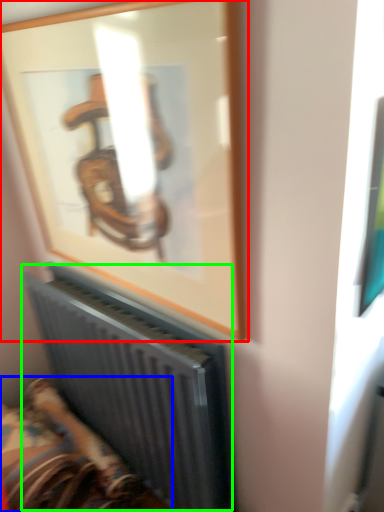
Question: Based on their relative distances, which object is nearer to picture frame (highlighted by a red box)? Choose from furniture (highlighted by a blue box) and radiator (highlighted by a green box).

Choices:
 (A) furniture
 (B) radiator

Answer: (B)